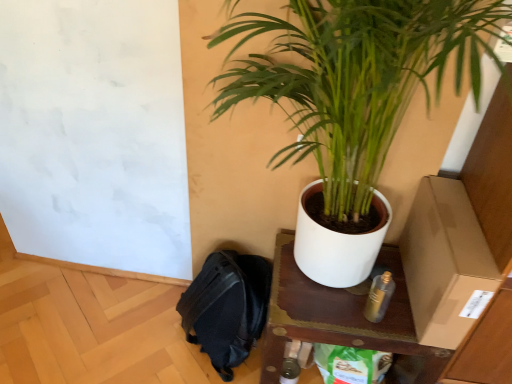
The image size is (512, 384). What are the coordinates of `free space to the left of brown cardboard box at right` in the screenshot? It's located at (349, 307).